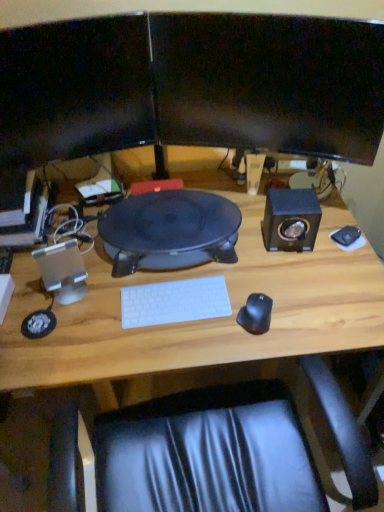
Find the location of a particular element. The image size is (384, 512). free space underneath white plastic keyboard at center (from a real-world perspective) is located at coordinates (172, 306).